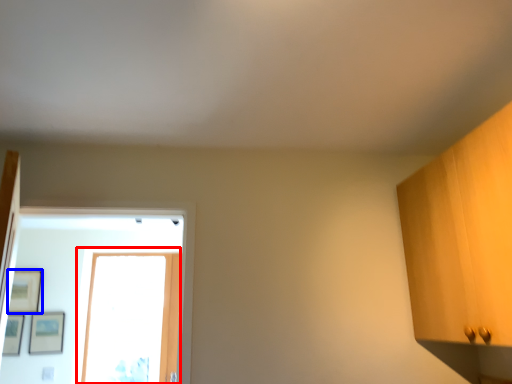
Question: Which object is closer to the camera taking this photo, glass door (highlighted by a red box) or picture frame (highlighted by a blue box)?

Choices:
 (A) glass door
 (B) picture frame

Answer: (B)